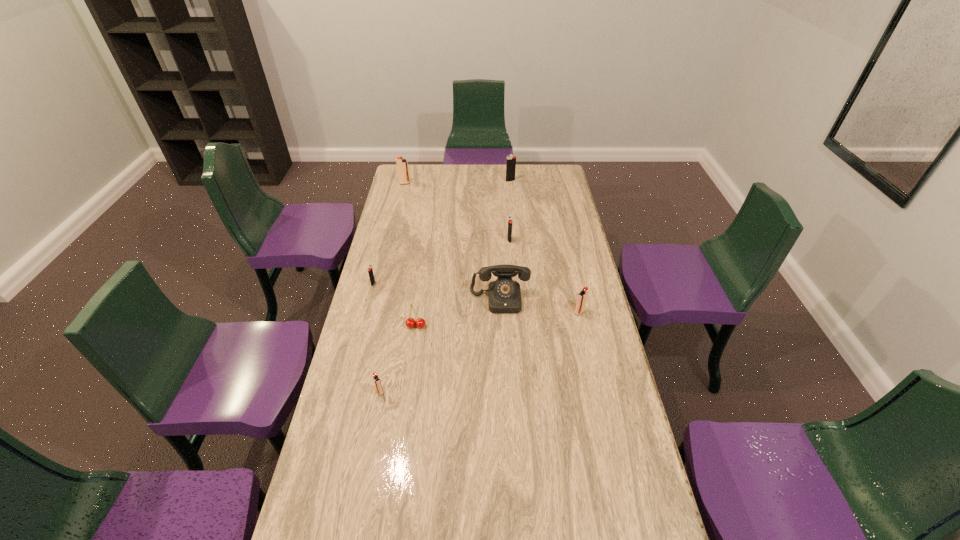
Select which black igniter appears as the third closest to the nearest object. Please provide its 2D coordinates. Your answer should be formatted as a tuple, i.e. [(x, y)], where the tuple contains the x and y coordinates of a point satisfying the conditions above.

[(511, 160)]

Locate which black igniter ranks in proximity to the telephone. Please provide its 2D coordinates. Your answer should be formatted as a tuple, i.e. [(x, y)], where the tuple contains the x and y coordinates of a point satisfying the conditions above.

[(509, 235)]

The width and height of the screenshot is (960, 540). Find the location of `vacant space that satisfies the following two spatial constraints: 1. on the back side of the biggest black igniter; 2. on the right side of the nearest black igniter`. vacant space that satisfies the following two spatial constraints: 1. on the back side of the biggest black igniter; 2. on the right side of the nearest black igniter is located at coordinates (399, 181).